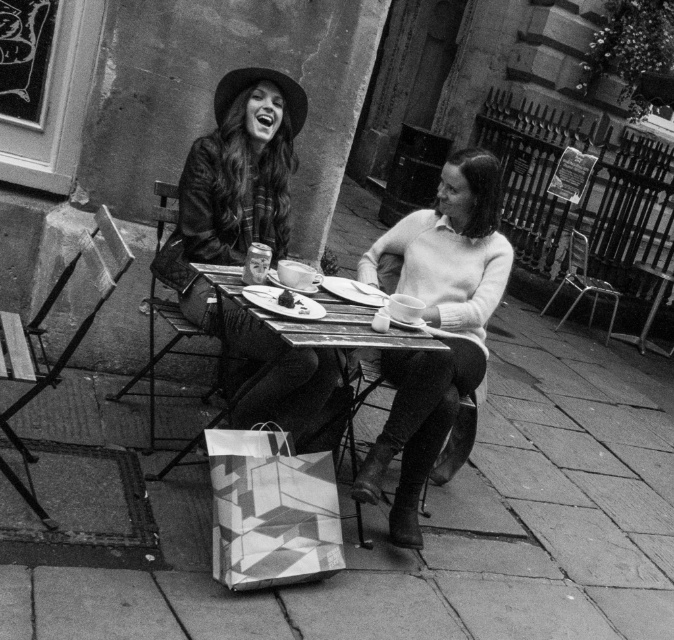
You are standing at the entrance of the outdoor cafe and want to find the knitted sweater at center. According to the coordinates given, in which direction should you look to locate it?

The knitted sweater at center is located at point (435, 324), which means it is in the center of the image. Look straight ahead to find it.

You are a fashion designer observing two people at a cafe table. You notice the knitted sweater at center and the leather jacket at center. Which clothing item would require more fabric to produce?

The knitted sweater at center requires more fabric to produce since it has a larger size compared to the leather jacket at center.

You are at an outdoor cafe and want to place a small vase between the two people seated at the table. The coordinates for the geometric patterned paper bag at lower center are given as point (270, 509). Can you determine if the vase will fit between the two people without overlapping them?

The geometric patterned paper bag at lower center is located at point (270, 509). Since the vase needs to be placed between the two people, the exact coordinates would depend on their positions. However, the provided coordinates indicate the bag is at lower center, which is likely near the table. Without specific spatial details about the people, it is uncertain if the vase will fit without overlapping them.